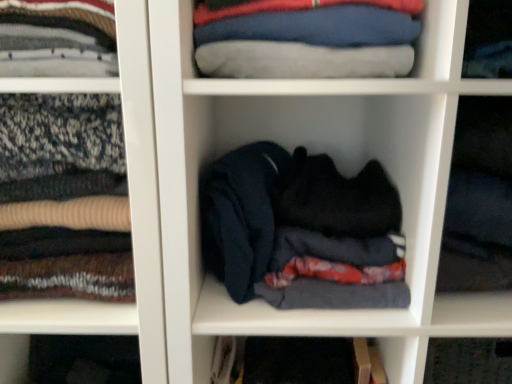
Question: Does dark fabric at center, marked as the second cabinet in a left-to-right arrangement, turn towards dark blue fabric at center, which ranks as the 1th cabinet in left-to-right order?

Choices:
 (A) no
 (B) yes

Answer: (A)

Question: Does dark fabric at center, marked as the second cabinet in a left-to-right arrangement, contain dark blue fabric at center, the third cabinet viewed from the right?

Choices:
 (A) no
 (B) yes

Answer: (A)

Question: From a real-world perspective, is dark fabric at center, marked as the second cabinet in a left-to-right arrangement, positioned under dark blue fabric at center, the third cabinet viewed from the right, based on gravity?

Choices:
 (A) yes
 (B) no

Answer: (B)

Question: Does dark fabric at center, marked as the second cabinet in a left-to-right arrangement, appear on the left side of dark blue fabric at center, which ranks as the 1th cabinet in left-to-right order?

Choices:
 (A) yes
 (B) no

Answer: (B)

Question: Does dark fabric at center, marked as the second cabinet in a left-to-right arrangement, have a greater height compared to dark blue fabric at center, the third cabinet viewed from the right?

Choices:
 (A) yes
 (B) no

Answer: (B)

Question: Considering the positions of dark blue fabric at center, which ranks as the 1th cabinet in left-to-right order, and dark fabric at center, marked as the second cabinet in a left-to-right arrangement, in the image, is dark blue fabric at center, which ranks as the 1th cabinet in left-to-right order, bigger or smaller than dark fabric at center, marked as the second cabinet in a left-to-right arrangement,?

Choices:
 (A) big
 (B) small

Answer: (A)

Question: In the image, is dark blue fabric at center, which ranks as the 1th cabinet in left-to-right order, on the left side or the right side of dark fabric at center, marked as the second cabinet in a left-to-right arrangement?

Choices:
 (A) right
 (B) left

Answer: (B)

Question: From a real-world perspective, is dark blue fabric at center, the third cabinet viewed from the right, physically located above or below dark fabric at center, marked as the second cabinet in a left-to-right arrangement?

Choices:
 (A) below
 (B) above

Answer: (A)

Question: From the image's perspective, is dark blue fabric at center, the third cabinet viewed from the right, above or below dark fabric at center, which ranks as the 2th cabinet in right-to-left order?

Choices:
 (A) above
 (B) below

Answer: (B)

Question: From the image's perspective, relative to black fabric at center, placed as the third cabinet when sorted from left to right, is dark fabric at center, marked as the second cabinet in a left-to-right arrangement, above or below?

Choices:
 (A) below
 (B) above

Answer: (A)

Question: In terms of size, does dark fabric at center, marked as the second cabinet in a left-to-right arrangement, appear bigger or smaller than black fabric at center, placed as the third cabinet when sorted from left to right?

Choices:
 (A) small
 (B) big

Answer: (B)

Question: Is point (369, 104) closer or farther from the camera than point (505, 244)?

Choices:
 (A) farther
 (B) closer

Answer: (A)

Question: Considering the positions of dark fabric at center, which ranks as the 2th cabinet in right-to-left order, and black fabric at center, placed as the third cabinet when sorted from left to right, in the image, is dark fabric at center, which ranks as the 2th cabinet in right-to-left order, taller or shorter than black fabric at center, placed as the third cabinet when sorted from left to right,?

Choices:
 (A) short
 (B) tall

Answer: (A)

Question: From a real-world perspective, is blue cotton shirt at upper center above or below dark blue fabric at center, the third cabinet viewed from the right?

Choices:
 (A) below
 (B) above

Answer: (B)

Question: In terms of size, does blue cotton shirt at upper center appear bigger or smaller than dark blue fabric at center, the third cabinet viewed from the right?

Choices:
 (A) big
 (B) small

Answer: (B)